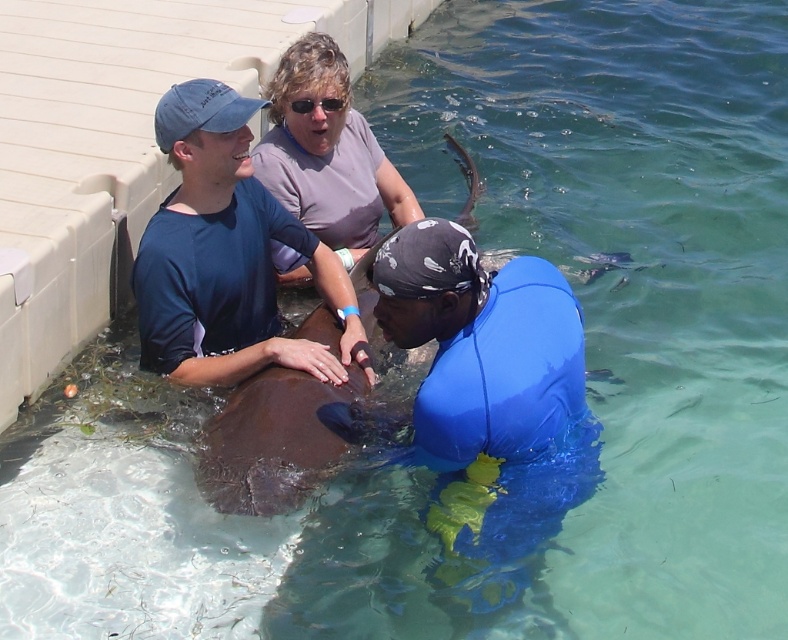
Which is more to the left, blue matte shirt at upper left or purple matte shirt at upper center?

From the viewer's perspective, blue matte shirt at upper left appears more on the left side.

Is point (165, 250) farther from viewer compared to point (290, 88)?

That is False.

Identify the location of blue matte shirt at upper left. (225, 256).

Is point (484, 502) positioned before point (173, 124)?

Yes.

Measure the distance from blue matte wetsuit at lower right to blue matte shirt at upper left.

The distance of blue matte wetsuit at lower right from blue matte shirt at upper left is 38.41 inches.

Is point (495, 296) closer to viewer compared to point (205, 252)?

Yes, it is in front of point (205, 252).

What are the coordinates of `blue matte wetsuit at lower right` in the screenshot? It's located at coord(489,392).

Does blue matte wetsuit at lower right have a greater height compared to purple matte shirt at upper center?

Correct, blue matte wetsuit at lower right is much taller as purple matte shirt at upper center.

Can you confirm if blue matte wetsuit at lower right is smaller than purple matte shirt at upper center?

No, blue matte wetsuit at lower right is not smaller than purple matte shirt at upper center.

Is point (485, 556) farther from viewer compared to point (299, 211)?

No, (485, 556) is closer to viewer.

Locate an element on the screen. This screenshot has height=640, width=788. blue matte wetsuit at lower right is located at coordinates (489, 392).